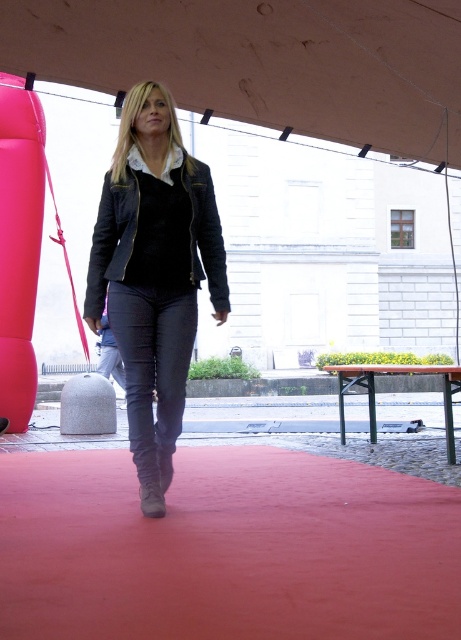
Consider the image. Is red carpet at center positioned in front of brown fabric canopy at upper center?

Yes, it is in front of brown fabric canopy at upper center.

Measure the distance between red carpet at center and camera.

The distance of red carpet at center from camera is 2.34 meters.

Does point (93, 538) come farther from viewer compared to point (33, 38)?

No.

Locate an element on the screen. red carpet at center is located at coordinates (225, 548).

The image size is (461, 640). I want to click on velvet-like black jacket at center, so click(x=111, y=240).

Is velvet-like black jacket at center wider than denim jeans at center?

In fact, velvet-like black jacket at center might be narrower than denim jeans at center.

Identify the location of velvet-like black jacket at center. (111, 240).

Who is positioned more to the right, red carpet at center or velvet black jacket at center?

From the viewer's perspective, red carpet at center appears more on the right side.

Which is behind, point (321, 596) or point (141, 384)?

The point (141, 384) is more distant.

Locate an element on the screen. red carpet at center is located at coordinates (225, 548).